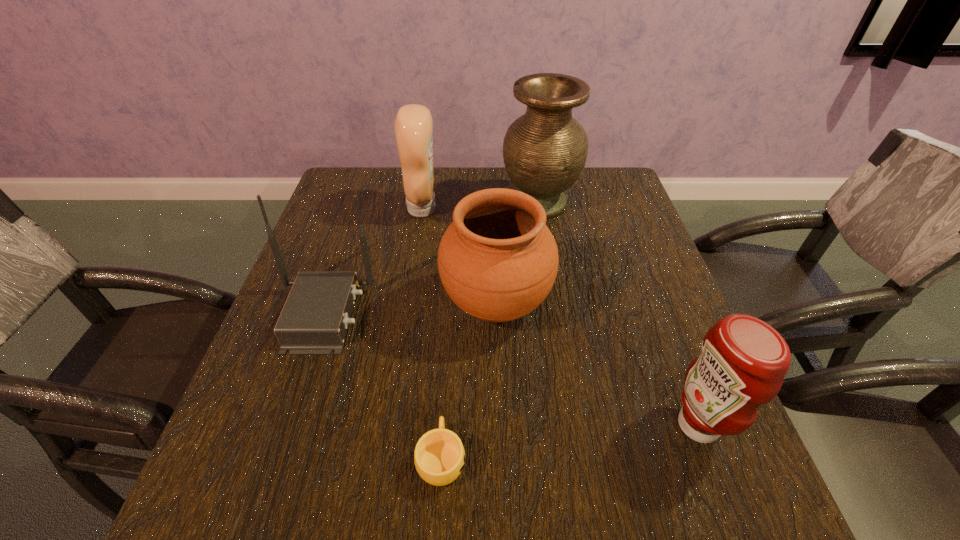
This screenshot has height=540, width=960. I want to click on empty space that is in between the farther condiment and the shortest object, so [432, 333].

You are a GUI agent. You are given a task and a screenshot of the screen. Output one action in this format:
    pyautogui.click(x=<x>, y=<y>)
    Task: Click on the free space between the farther condiment and the cup
    The height and width of the screenshot is (540, 960).
    Given the screenshot: What is the action you would take?
    pyautogui.click(x=432, y=333)

Locate an element on the screen. The height and width of the screenshot is (540, 960). vacant area that lies between the leftmost object and the farther condiment is located at coordinates pyautogui.click(x=373, y=261).

Find the location of a particular element. vacant area between the shorter condiment and the cup is located at coordinates (569, 441).

Find the location of a particular element. This screenshot has width=960, height=540. vacant area that lies between the shorter condiment and the pottery is located at coordinates (597, 364).

I want to click on object that is the second closest to the farther condiment, so click(545, 150).

The width and height of the screenshot is (960, 540). Find the location of `the third closest object to the vase`. the third closest object to the vase is located at coordinates (314, 320).

Identify the location of free space that satisfies the following two spatial constraints: 1. on the back side of the nearer condiment; 2. on the label of the fifth object from right to left. This screenshot has width=960, height=540. (616, 208).

Where is `vacant area in the image that satisfies the following two spatial constraints: 1. on the label of the farther condiment; 2. on the back side of the rightmost object`? The image size is (960, 540). vacant area in the image that satisfies the following two spatial constraints: 1. on the label of the farther condiment; 2. on the back side of the rightmost object is located at coordinates (388, 425).

Identify the location of free spot that satisfies the following two spatial constraints: 1. on the label of the shorter condiment; 2. on the left side of the fifth object from right to left. (388, 425).